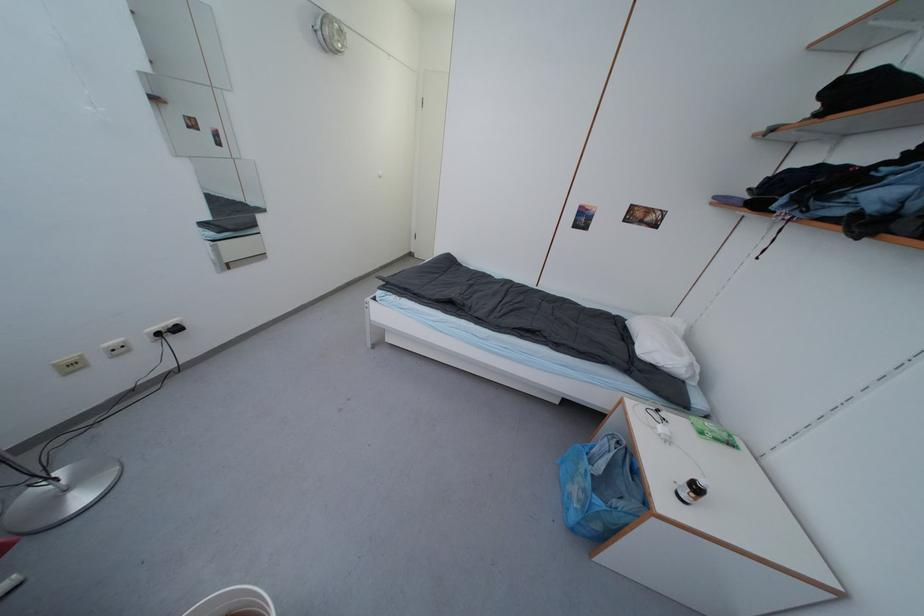
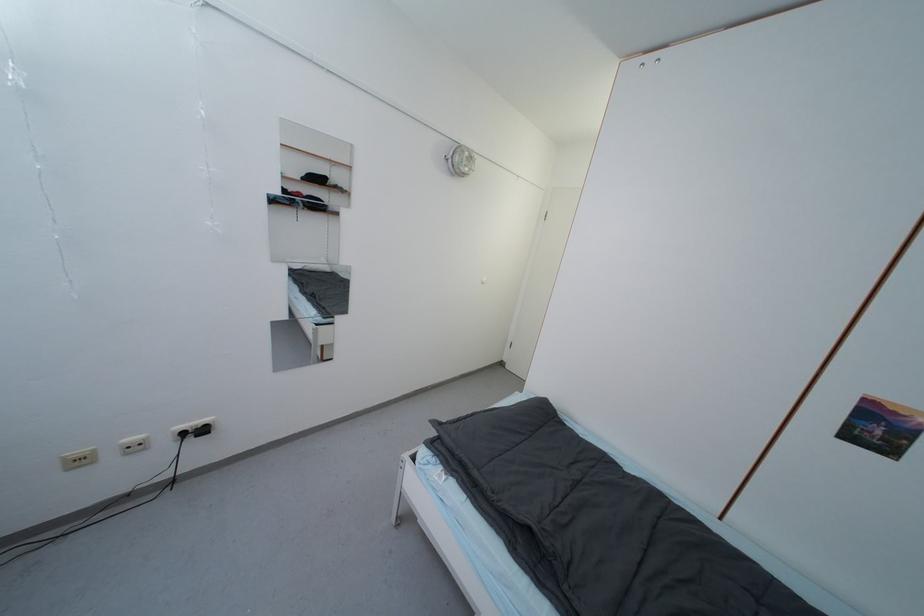
Locate, in the second image, the point that corresponds to [124,353] in the first image.

(140, 450)